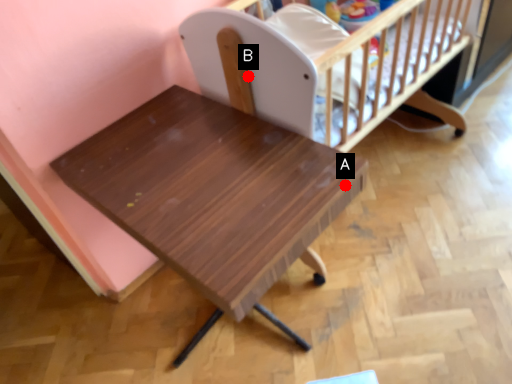
Question: Two points are circled on the image, labeled by A and B beside each circle. Which point is farther to the camera?

Choices:
 (A) A is further
 (B) B is further

Answer: (B)